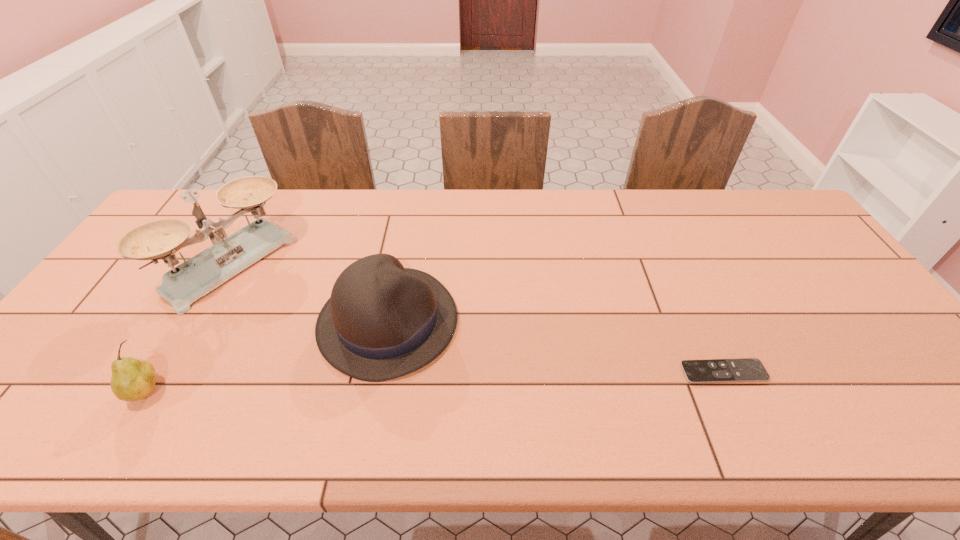
You are a GUI agent. You are given a task and a screenshot of the screen. Output one action in this format:
    pyautogui.click(x=<x>, y=<y>)
    Task: Click on the free space that satisfies the following two spatial constraints: 1. on the front side of the third shortest object; 2. on the left side of the remote control
    This screenshot has width=960, height=540.
    Given the screenshot: What is the action you would take?
    pyautogui.click(x=378, y=372)